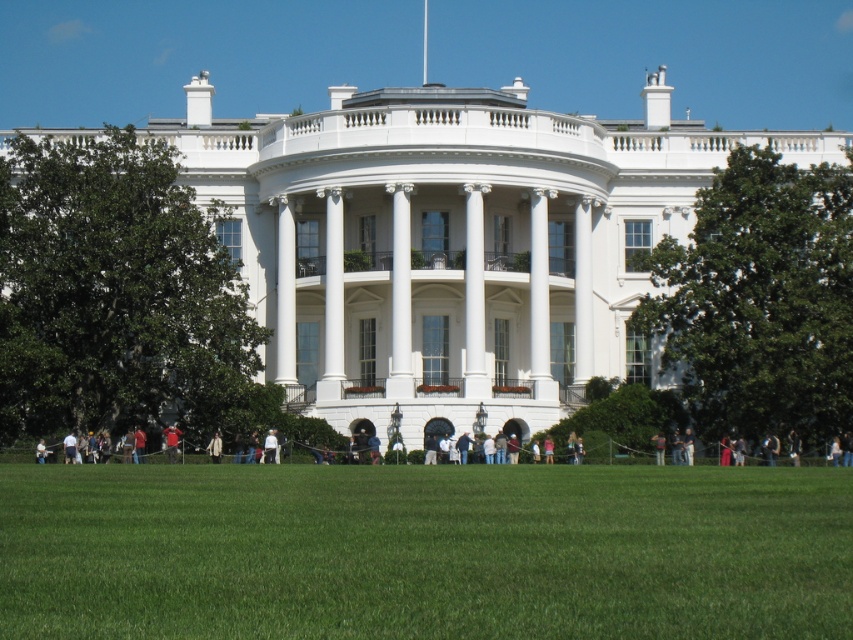
Who is positioned more to the left, green grass at lower center or light brown leather jacket at center?

Positioned to the left is light brown leather jacket at center.

Which is behind, point (329, 509) or point (218, 448)?

The point (218, 448) is behind.

I want to click on green grass at lower center, so click(424, 552).

Who is shorter, white cotton shirt at center or camouflage jacket at center?

camouflage jacket at center is shorter.

Can you confirm if white cotton shirt at center is positioned to the left of camouflage jacket at center?

Yes, white cotton shirt at center is to the left of camouflage jacket at center.

Where is `white cotton shirt at center`? white cotton shirt at center is located at coordinates (270, 448).

You are a GUI agent. You are given a task and a screenshot of the screen. Output one action in this format:
    pyautogui.click(x=<x>, y=<y>)
    Task: Click on the white cotton shirt at center
    The width and height of the screenshot is (853, 640).
    Given the screenshot: What is the action you would take?
    pyautogui.click(x=270, y=448)

Does white cotton shirt at center appear on the left side of light brown leather jacket at center?

In fact, white cotton shirt at center is to the right of light brown leather jacket at center.

Is point (265, 452) closer to camera compared to point (212, 445)?

Yes.

Locate an element on the screen. Image resolution: width=853 pixels, height=640 pixels. white cotton shirt at center is located at coordinates (270, 448).